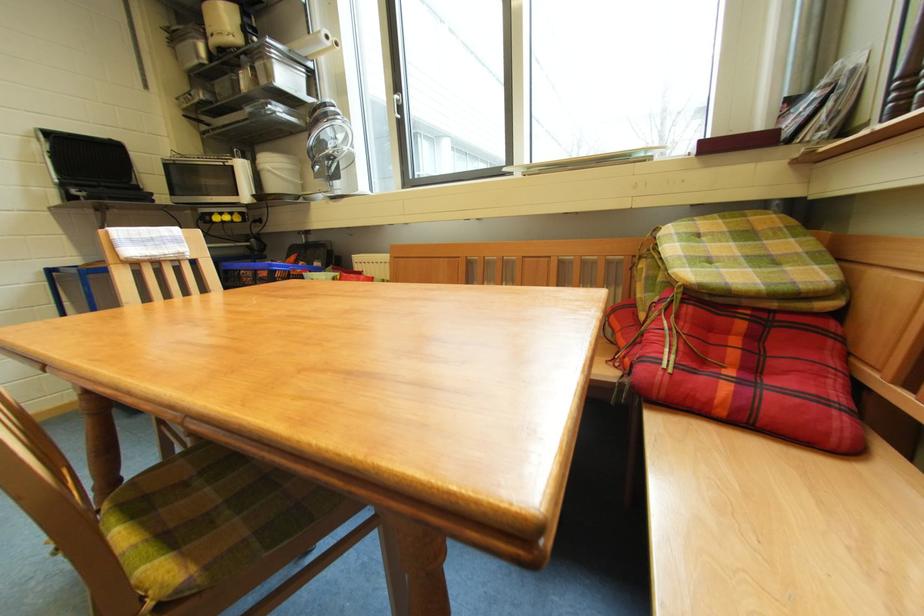
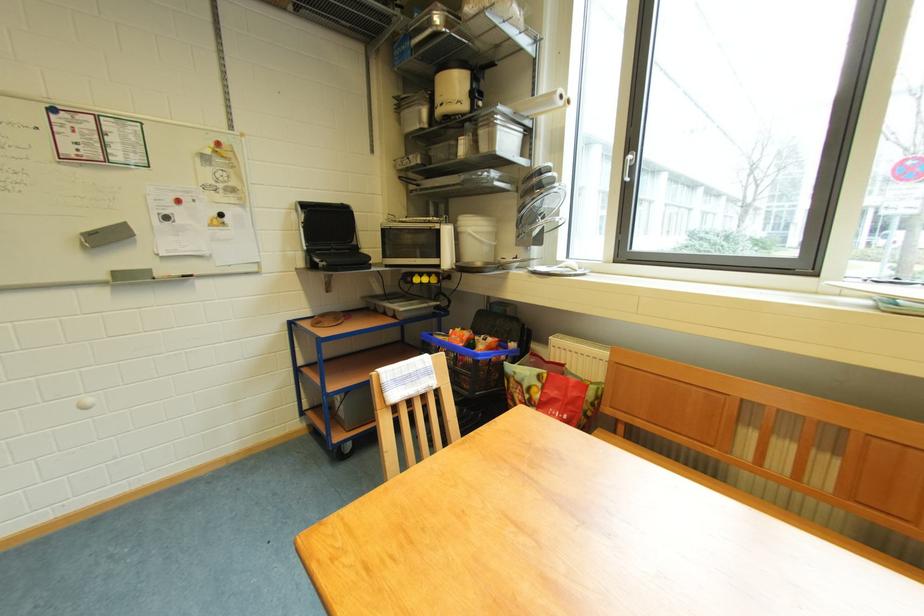
Where in the second image is the point corresponding to pixel 215 221 from the first image?

(417, 282)